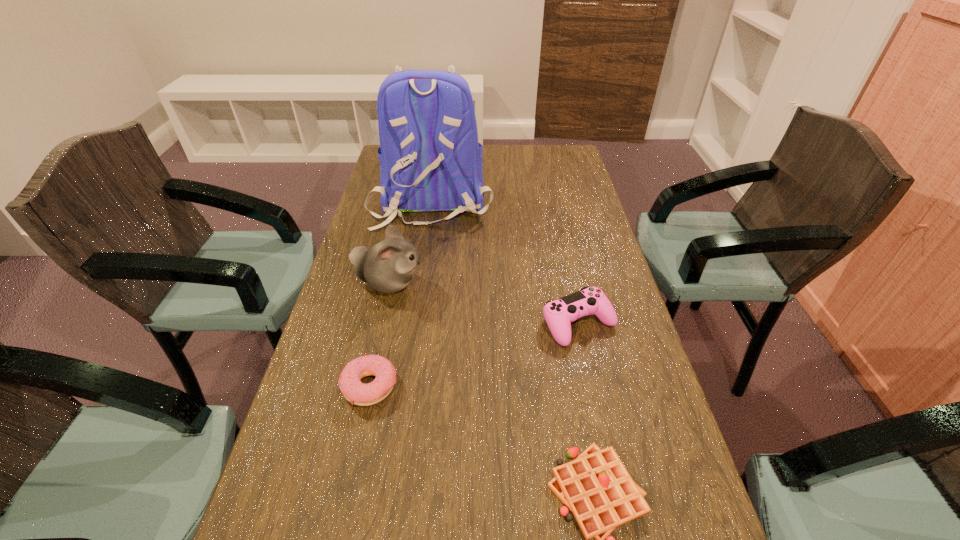
This screenshot has height=540, width=960. What are the coordinates of `vacant area that satisfies the following two spatial constraints: 1. on the back side of the control; 2. on the left side of the second nearest object` in the screenshot? It's located at (383, 323).

At what (x,y) coordinates should I click in order to perform the action: click on vacant space that satisfies the following two spatial constraints: 1. on the back of the backpack; 2. on the face of the fourth shortest object. Please return your answer as a coordinate pair (x, y). Looking at the image, I should click on pyautogui.click(x=420, y=284).

Where is `vacant position in the image that satisfies the following two spatial constraints: 1. on the back of the farthest object; 2. on the right side of the third shortest object`? The image size is (960, 540). vacant position in the image that satisfies the following two spatial constraints: 1. on the back of the farthest object; 2. on the right side of the third shortest object is located at coordinates (414, 323).